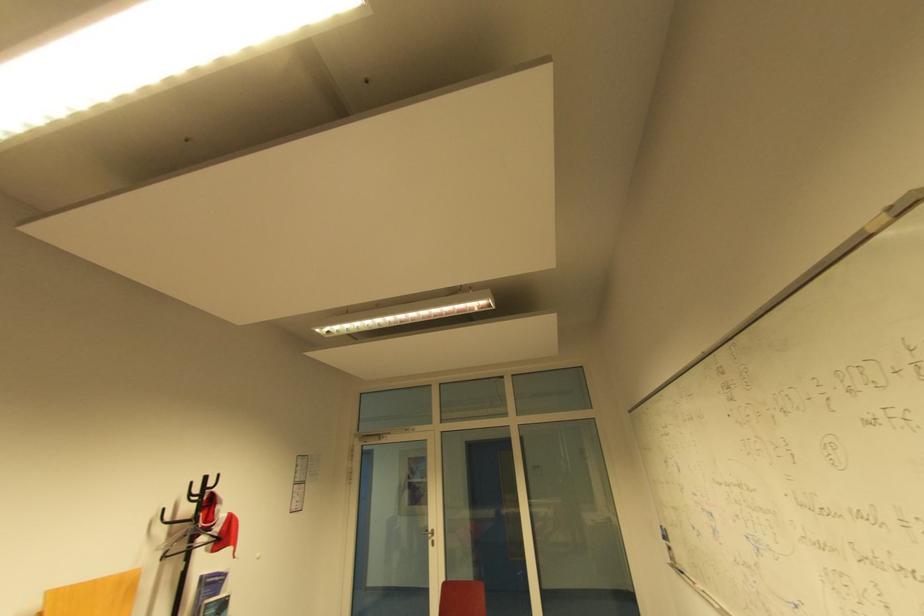
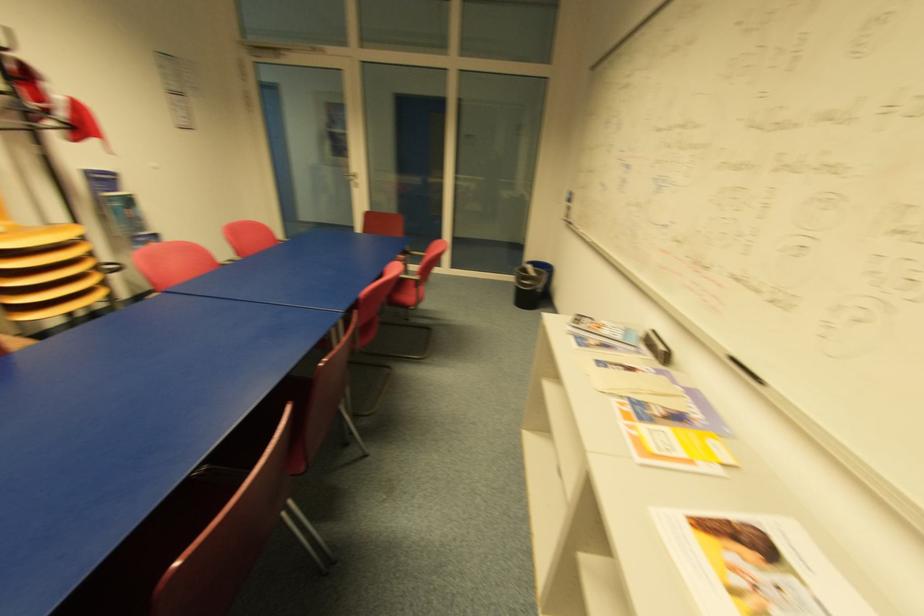
Based on the continuous images, in which direction is the camera rotating?

The camera's rotation is toward right-down.